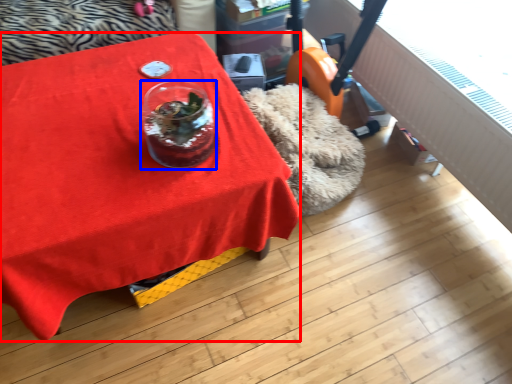
Question: Which of the following is the closest to the observer, table (highlighted by a red box) or glass vase (highlighted by a blue box)?

Choices:
 (A) table
 (B) glass vase

Answer: (A)